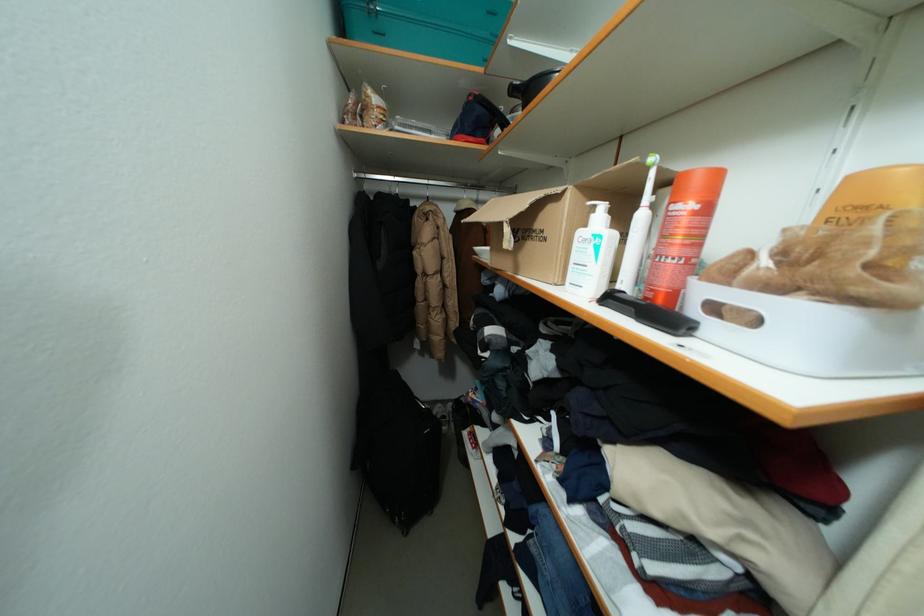
Locate an element on the screen. This screenshot has height=616, width=924. yellow shampoo bottle is located at coordinates [x=591, y=254].